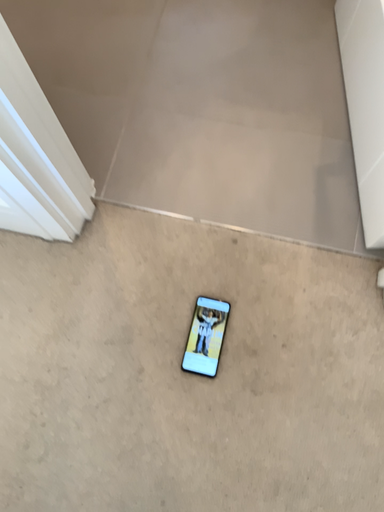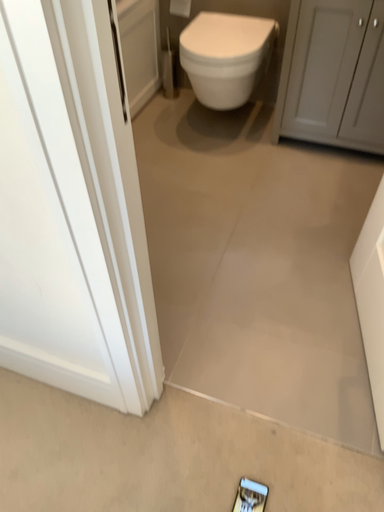
Question: How did the camera likely rotate when shooting the video?

Choices:
 (A) rotated upward
 (B) rotated downward

Answer: (A)